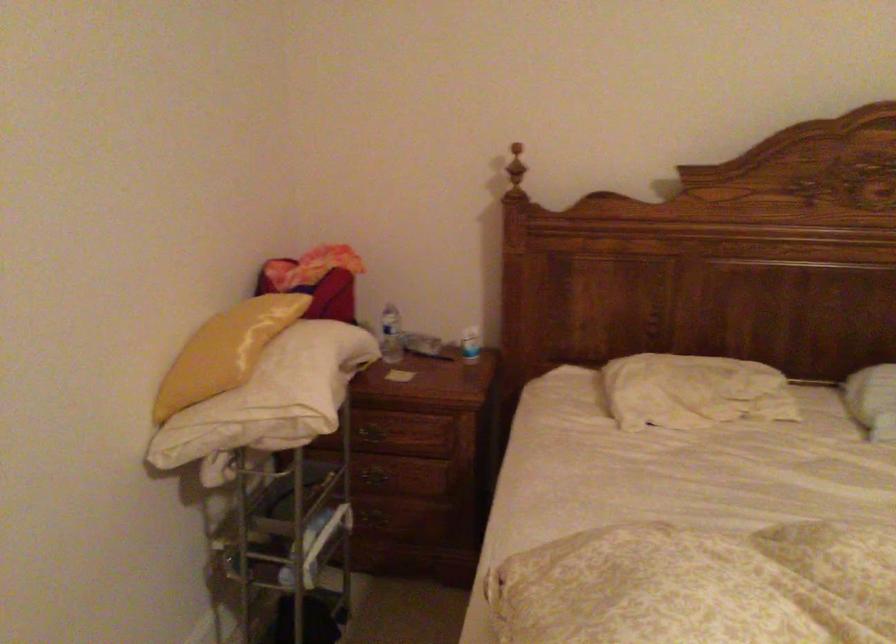
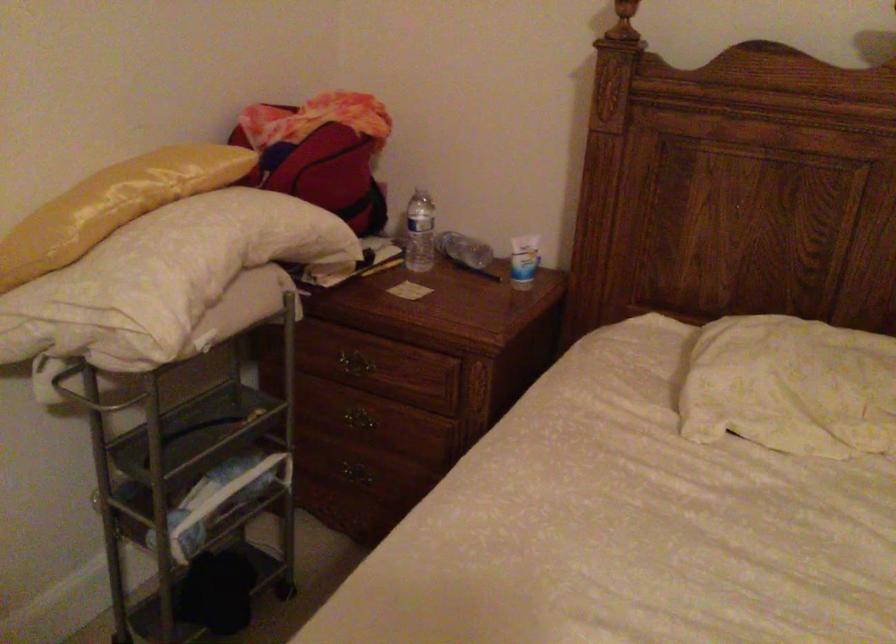
Question: The images are taken continuously from a first-person perspective. In which direction is your viewpoint rotating?

Choices:
 (A) Left
 (B) Right
 (C) Up
 (D) Down

Answer: (A)